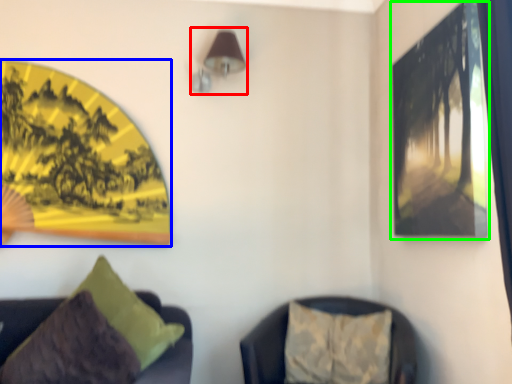
Question: Which object is the closest to the lamp (highlighted by a red box)? Choose among these: picture frame (highlighted by a blue box) or picture frame (highlighted by a green box).

Choices:
 (A) picture frame
 (B) picture frame

Answer: (A)